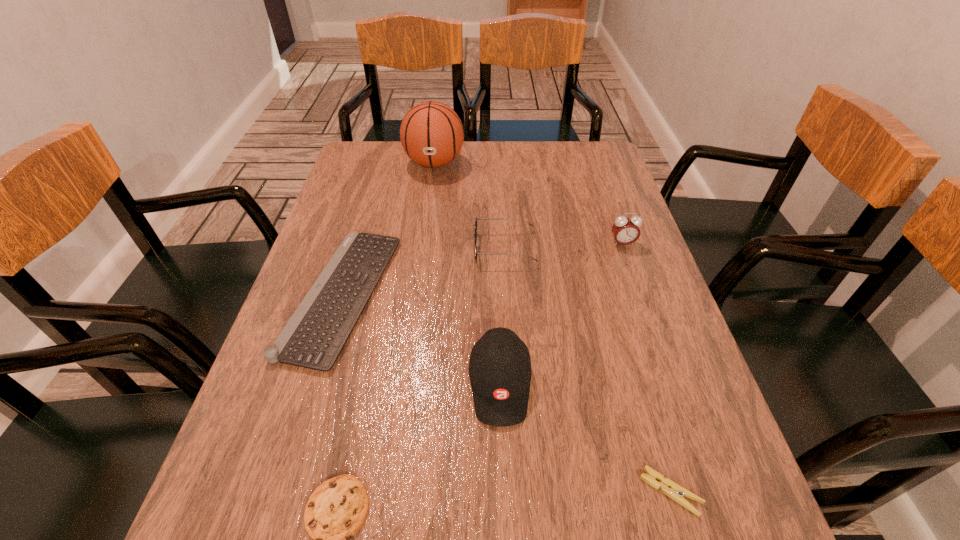
Identify the location of the tallest object. (431, 133).

Locate an element on the screen. This screenshot has height=540, width=960. basketball is located at coordinates (431, 133).

Locate an element on the screen. The image size is (960, 540). alarm clock is located at coordinates click(625, 230).

Find the location of a particular element. Image resolution: width=960 pixels, height=540 pixels. baseball cap is located at coordinates (500, 371).

The width and height of the screenshot is (960, 540). What are the coordinates of `spectacles` in the screenshot? It's located at (475, 234).

In order to click on computer keyboard in this screenshot , I will do `click(314, 336)`.

This screenshot has height=540, width=960. What are the coordinates of `the shortest object` in the screenshot? It's located at tap(673, 490).

You are a GUI agent. You are given a task and a screenshot of the screen. Output one action in this format:
    pyautogui.click(x=<x>, y=<y>)
    Task: Click on the vacant area situated 0.230m on the side where the inflation valve is located
    The image size is (960, 540).
    Given the screenshot: What is the action you would take?
    pyautogui.click(x=425, y=227)

The height and width of the screenshot is (540, 960). What are the coordinates of `vacant space positioned on the clock face of the alarm clock` in the screenshot? It's located at (656, 339).

The image size is (960, 540). What are the coordinates of `free space located with a logo on the front of the baseball cap` in the screenshot? It's located at (504, 488).